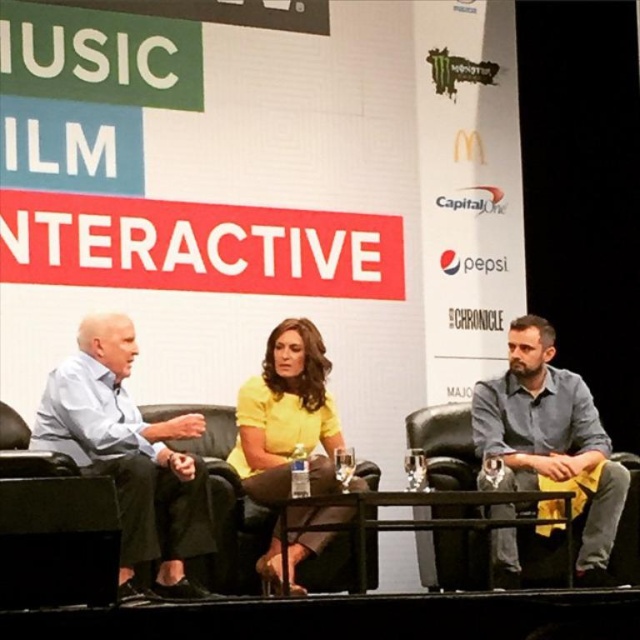
Between light blue shirt at left and gray cotton shirt at right, which one is positioned lower?

gray cotton shirt at right is below.

Is light blue shirt at left further to the viewer compared to gray cotton shirt at right?

No, it is not.

What do you see at coordinates (129, 454) in the screenshot? This screenshot has height=640, width=640. I see `light blue shirt at left` at bounding box center [129, 454].

You are a GUI agent. You are given a task and a screenshot of the screen. Output one action in this format:
    pyautogui.click(x=<x>, y=<y>)
    Task: Click on the light blue shirt at left
    
    Given the screenshot: What is the action you would take?
    pyautogui.click(x=129, y=454)

Who is higher up, gray cotton shirt at right or yellow matte shirt at center?

Positioned higher is gray cotton shirt at right.

Is point (532, 320) in front of point (289, 419)?

No, (532, 320) is behind (289, 419).

Who is more forward, (529, 342) or (324, 364)?

Positioned in front is point (324, 364).

Locate an element on the screen. gray cotton shirt at right is located at coordinates (550, 436).

Who is positioned more to the right, light blue shirt at left or yellow matte shirt at center?

yellow matte shirt at center is more to the right.

This screenshot has height=640, width=640. Describe the element at coordinates (129, 454) in the screenshot. I see `light blue shirt at left` at that location.

What are the coordinates of `light blue shirt at left` in the screenshot? It's located at (129, 454).